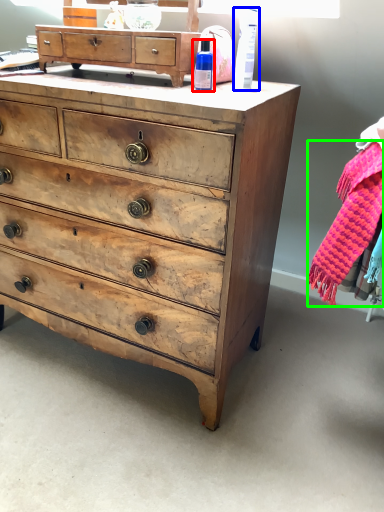
Question: Which is farther away from toiletry (highlighted by a red box)? toiletry (highlighted by a blue box) or clothing (highlighted by a green box)?

Choices:
 (A) toiletry
 (B) clothing

Answer: (B)